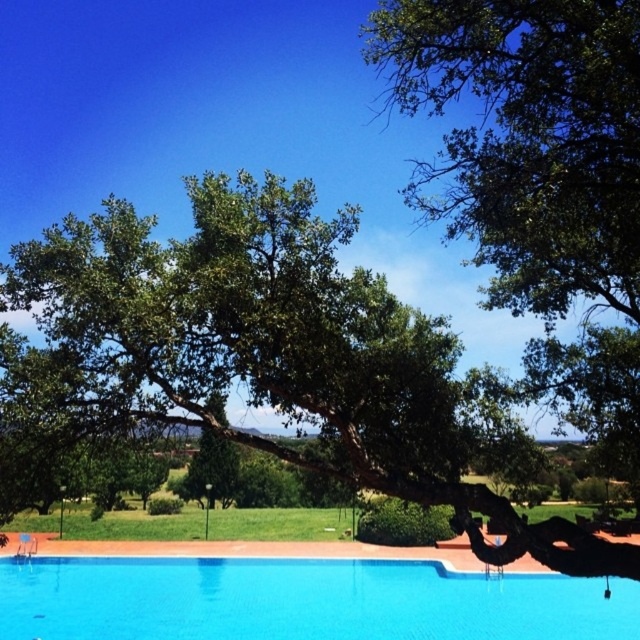
Question: Does green leafy oak tree at upper center appear over blue glassy swimming pool at center?

Choices:
 (A) no
 (B) yes

Answer: (B)

Question: Is green leafy oak tree at upper center closer to camera compared to blue glassy swimming pool at center?

Choices:
 (A) no
 (B) yes

Answer: (B)

Question: Which point is closer to the camera?

Choices:
 (A) (314, 362)
 (B) (358, 637)

Answer: (A)

Question: Considering the relative positions of green leafy oak tree at upper center and blue glassy swimming pool at center in the image provided, where is green leafy oak tree at upper center located with respect to blue glassy swimming pool at center?

Choices:
 (A) above
 (B) below

Answer: (A)